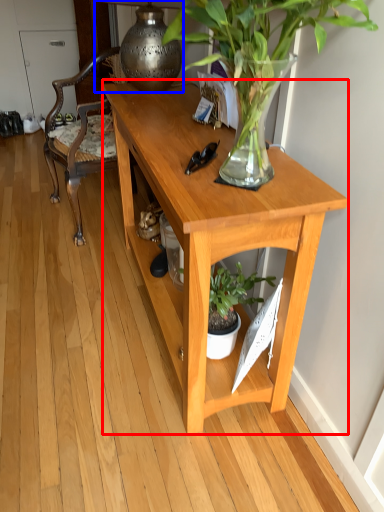
Question: Which of the following is the closest to the observer, desk (highlighted by a red box) or lamp (highlighted by a blue box)?

Choices:
 (A) desk
 (B) lamp

Answer: (A)